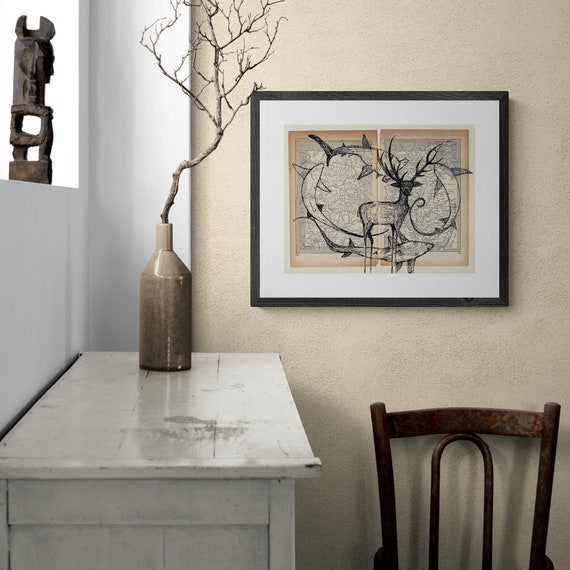
Find the location of `1 beige wall`. 1 beige wall is located at coordinates (377, 345).